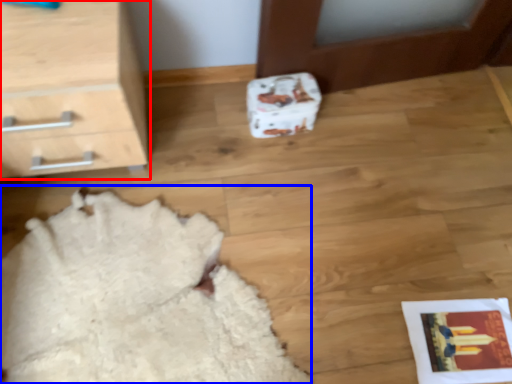
Question: Among these objects, which one is nearest to the camera, chest of drawers (highlighted by a red box) or blanket (highlighted by a blue box)?

Choices:
 (A) chest of drawers
 (B) blanket

Answer: (A)